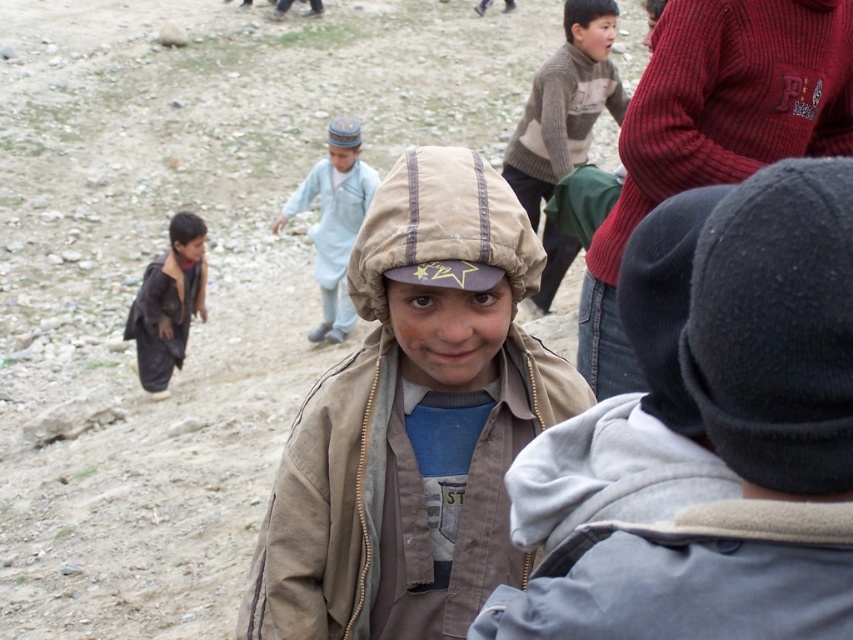
You are a photographer trying to capture a group photo of the children in the rural setting. You notice the knitted sweater at upper center and the dark brown leather jacket at lower left. Which child should you focus on first if you want to include both in the frame without moving the camera?

You should focus on the dark brown leather jacket at lower left first because the knitted sweater at upper center is to the right of it, so capturing the leftmost object first ensures both are in frame.

You are a photographer trying to capture the children in the scene. You notice two points marked in the image. Which point, point (422,227) or point (320,260), is closer to your camera lens?

Point (422,227) is closer to the camera than point (320,260).